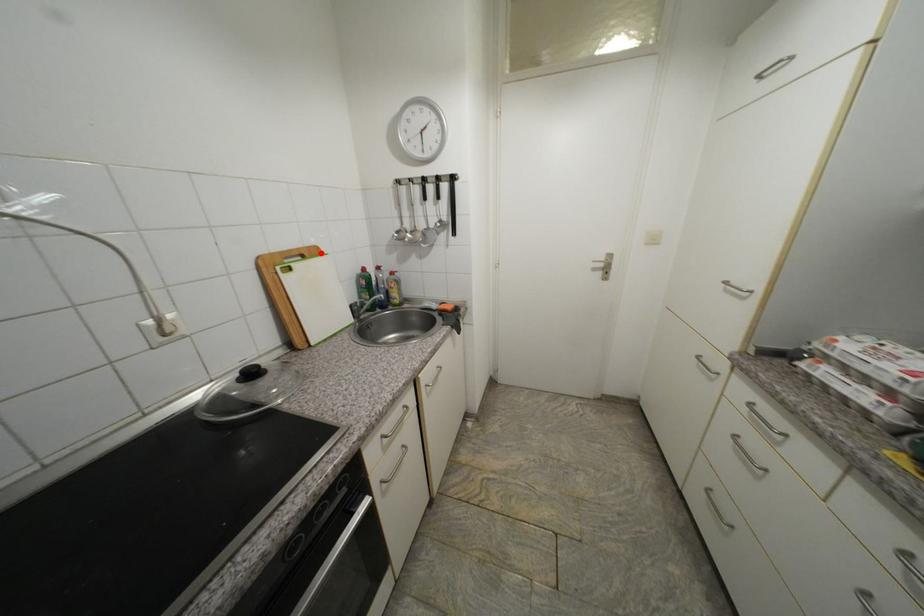
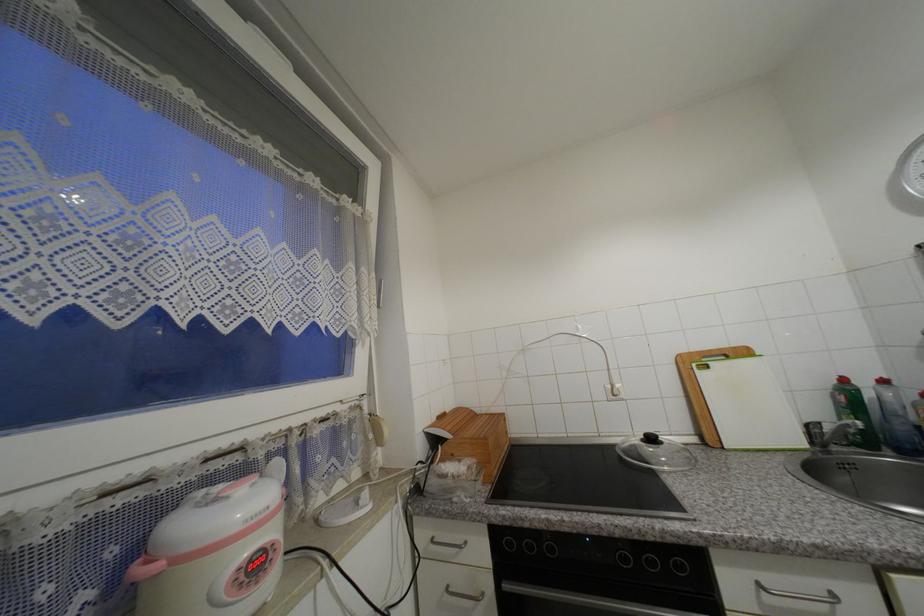
Where in the second image is the point corresponding to the highlighted location from the first image?

(749, 354)